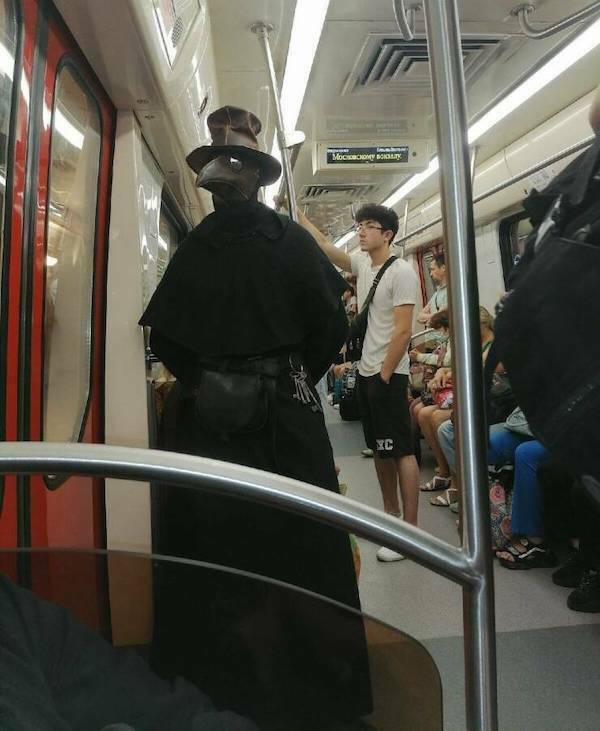
The image size is (600, 731). What are the coordinates of `light reflections` in the screenshot? It's located at (65, 126), (0, 66), (25, 91).